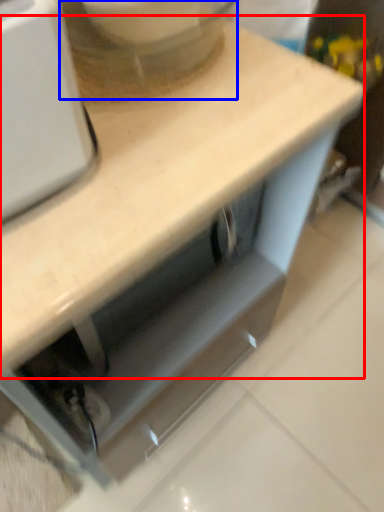
Question: Which point is closer to the camera, countertop (highlighted by a red box) or mixer (highlighted by a blue box)?

Choices:
 (A) countertop
 (B) mixer

Answer: (A)